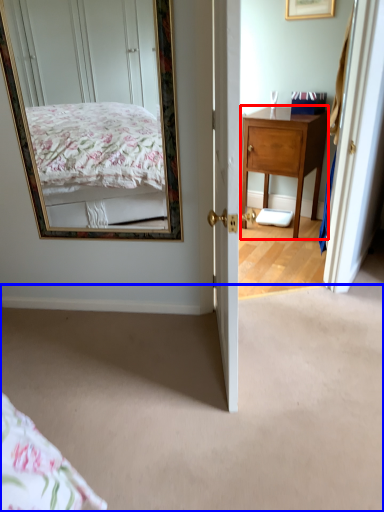
Question: Which of the following is the farthest to the observer, desk (highlighted by a red box) or plain (highlighted by a blue box)?

Choices:
 (A) desk
 (B) plain

Answer: (A)